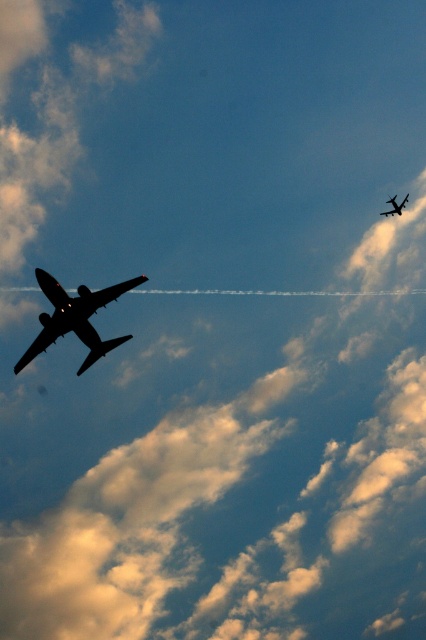
Question: Does silhouette metallic airplane at left have a greater width compared to silhouette metallic airplane at upper center?

Choices:
 (A) yes
 (B) no

Answer: (A)

Question: Which point is closer to the camera?

Choices:
 (A) (49, 278)
 (B) (393, 202)

Answer: (A)

Question: Which point is farther from the camera taking this photo?

Choices:
 (A) (x=400, y=211)
 (B) (x=54, y=332)

Answer: (A)

Question: Is silhouette metallic airplane at left thinner than silhouette metallic airplane at upper center?

Choices:
 (A) no
 (B) yes

Answer: (A)

Question: Considering the relative positions of silhouette metallic airplane at left and silhouette metallic airplane at upper center in the image provided, where is silhouette metallic airplane at left located with respect to silhouette metallic airplane at upper center?

Choices:
 (A) above
 (B) below

Answer: (B)